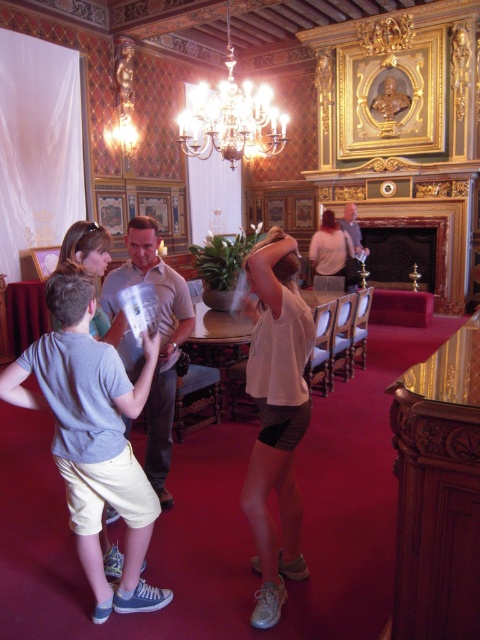
Question: Which point is closer to the camera taking this photo?

Choices:
 (A) (350, 216)
 (B) (93, 262)

Answer: (B)

Question: Which object is the closest to the smooth beige shirt at center?

Choices:
 (A) light beige shorts at lower left
 (B) light gray cotton shirt at center
 (C) silver/glass chandelier at upper center

Answer: (C)

Question: Is light brown leather shirt at center above smooth beige shirt at center?

Choices:
 (A) yes
 (B) no

Answer: (B)

Question: Observing the image, what is the correct spatial positioning of light gray cotton shirt at center in reference to light beige shorts at lower left?

Choices:
 (A) left
 (B) right

Answer: (B)

Question: Considering the relative positions of white cotton tank top at center and light beige shorts at lower left in the image provided, where is white cotton tank top at center located with respect to light beige shorts at lower left?

Choices:
 (A) left
 (B) right

Answer: (B)

Question: Estimate the real-world distances between objects in this image. Which object is farther from the silver/glass chandelier at upper center?

Choices:
 (A) light beige shorts at lower left
 (B) smooth beige shirt at center

Answer: (A)